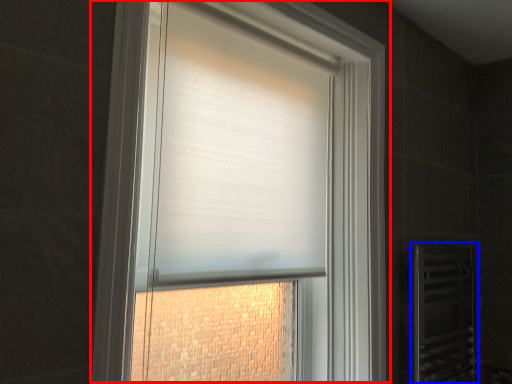
Question: Which object appears farthest to the camera in this image, window (highlighted by a red box) or screen door (highlighted by a blue box)?

Choices:
 (A) window
 (B) screen door

Answer: (B)